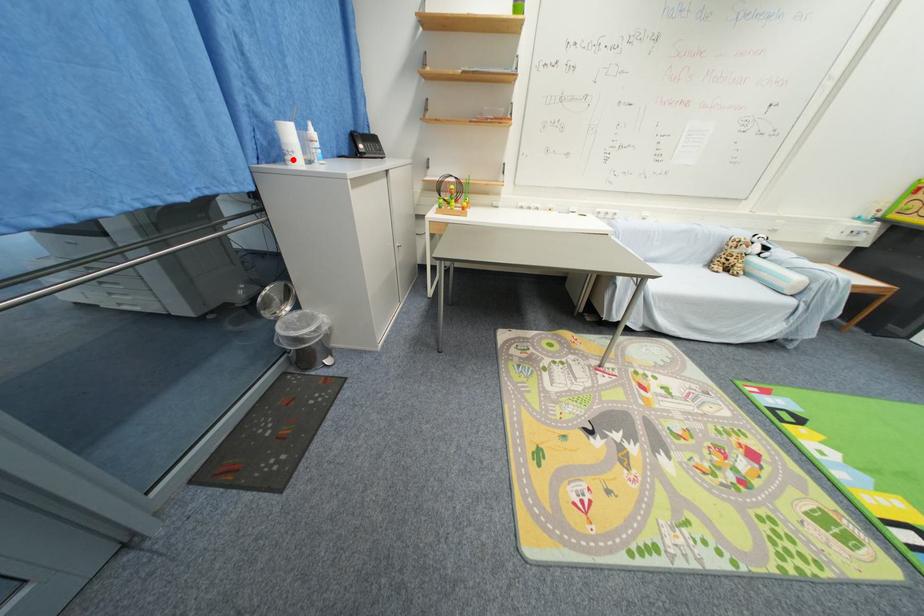
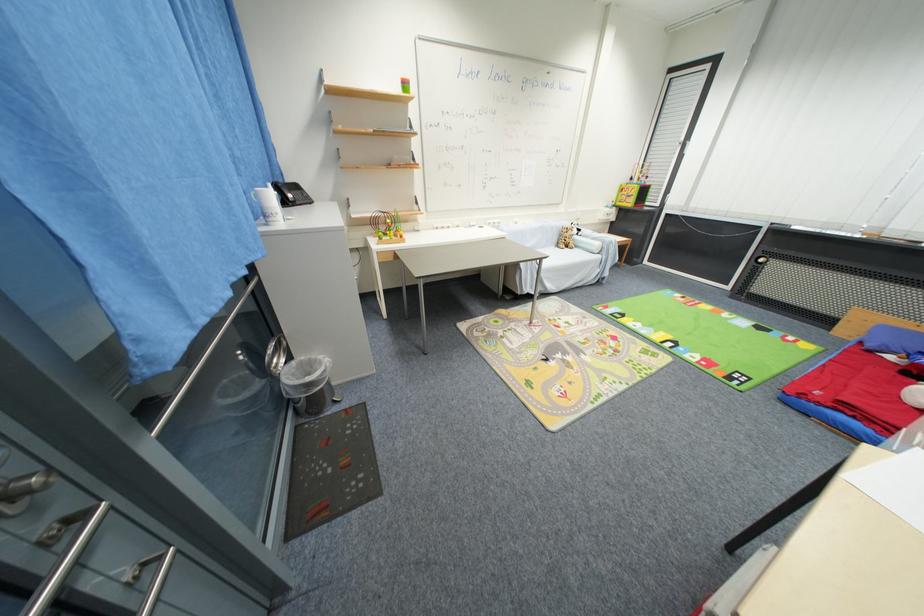
Where in the second image is the point corresponding to the highlighted location from the first image?

(275, 222)